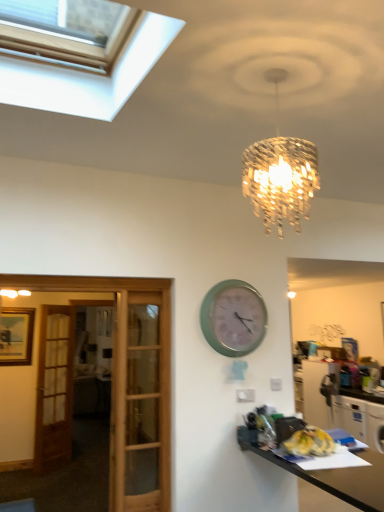
Question: Is white glossy cabinet at lower right positioned far away from green matte wall clock at center?

Choices:
 (A) no
 (B) yes

Answer: (B)

Question: Is white glossy cabinet at lower right to the right of green matte wall clock at center from the viewer's perspective?

Choices:
 (A) no
 (B) yes

Answer: (B)

Question: Is green matte wall clock at center located within white glossy cabinet at lower right?

Choices:
 (A) yes
 (B) no

Answer: (B)

Question: Does white glossy cabinet at lower right turn towards green matte wall clock at center?

Choices:
 (A) no
 (B) yes

Answer: (A)

Question: Does white glossy cabinet at lower right have a smaller size compared to green matte wall clock at center?

Choices:
 (A) yes
 (B) no

Answer: (B)

Question: From the image's perspective, does white glossy cabinet at lower right appear lower than green matte wall clock at center?

Choices:
 (A) yes
 (B) no

Answer: (A)

Question: Is white glossy cabinet at lower right oriented away from brown wooden door at left?

Choices:
 (A) yes
 (B) no

Answer: (B)

Question: Can you confirm if white glossy cabinet at lower right is bigger than brown wooden door at left?

Choices:
 (A) no
 (B) yes

Answer: (B)

Question: From the image's perspective, is white glossy cabinet at lower right located above brown wooden door at left?

Choices:
 (A) yes
 (B) no

Answer: (B)

Question: Is white glossy cabinet at lower right outside of brown wooden door at left?

Choices:
 (A) yes
 (B) no

Answer: (A)

Question: Is white glossy cabinet at lower right to the right of brown wooden door at left from the viewer's perspective?

Choices:
 (A) yes
 (B) no

Answer: (A)

Question: Is white glossy cabinet at lower right wider than brown wooden door at left?

Choices:
 (A) yes
 (B) no

Answer: (A)

Question: Can you confirm if black glossy desk at lower right is taller than green matte wall clock at center?

Choices:
 (A) no
 (B) yes

Answer: (B)